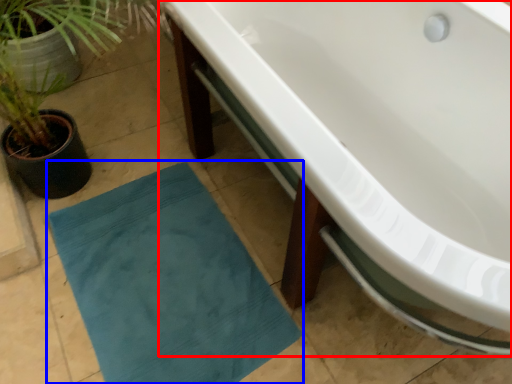
Question: Which point is further to the camera, bathtub (highlighted by a red box) or bath mat (highlighted by a blue box)?

Choices:
 (A) bathtub
 (B) bath mat

Answer: (B)